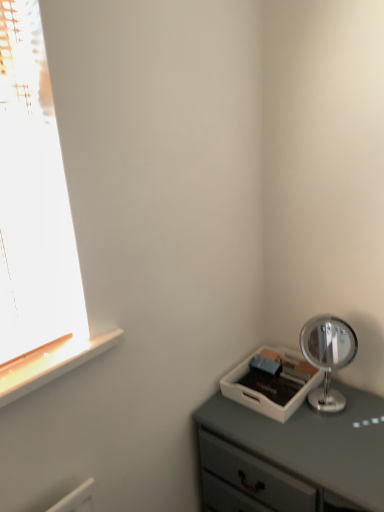
Question: Can you confirm if polished silver mirror at right is positioned to the left of white plastic tray at lower right?

Choices:
 (A) no
 (B) yes

Answer: (A)

Question: Considering the relative positions of polished silver mirror at right and white plastic tray at lower right in the image provided, is polished silver mirror at right behind white plastic tray at lower right?

Choices:
 (A) no
 (B) yes

Answer: (B)

Question: Considering the relative positions of polished silver mirror at right and white plastic tray at lower right in the image provided, is polished silver mirror at right to the right of white plastic tray at lower right from the viewer's perspective?

Choices:
 (A) no
 (B) yes

Answer: (B)

Question: Is polished silver mirror at right far from white plastic tray at lower right?

Choices:
 (A) yes
 (B) no

Answer: (B)

Question: From a real-world perspective, is polished silver mirror at right beneath white plastic tray at lower right?

Choices:
 (A) yes
 (B) no

Answer: (B)

Question: Are polished silver mirror at right and white plastic tray at lower right making contact?

Choices:
 (A) no
 (B) yes

Answer: (A)

Question: Can you confirm if white plastic tray at lower right is positioned to the left of polished silver mirror at right?

Choices:
 (A) no
 (B) yes

Answer: (B)

Question: Is white plastic tray at lower right positioned behind polished silver mirror at right?

Choices:
 (A) yes
 (B) no

Answer: (B)

Question: Is polished silver mirror at right inside white plastic tray at lower right?

Choices:
 (A) yes
 (B) no

Answer: (B)

Question: Could you tell me if white plastic tray at lower right is turned towards polished silver mirror at right?

Choices:
 (A) no
 (B) yes

Answer: (A)

Question: Does white plastic tray at lower right have a greater width compared to polished silver mirror at right?

Choices:
 (A) yes
 (B) no

Answer: (A)

Question: From the image's perspective, does white plastic tray at lower right appear higher than polished silver mirror at right?

Choices:
 (A) no
 (B) yes

Answer: (A)

Question: Based on their positions, is polished silver mirror at right located to the left or right of white plastic tray at lower right?

Choices:
 (A) right
 (B) left

Answer: (A)